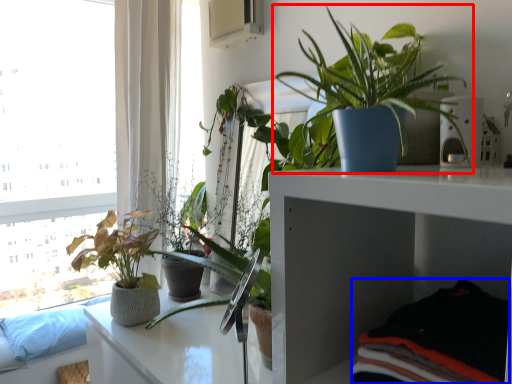
Question: Which point is further to the camera, houseplant (highlighted by a red box) or clothing (highlighted by a blue box)?

Choices:
 (A) houseplant
 (B) clothing

Answer: (A)